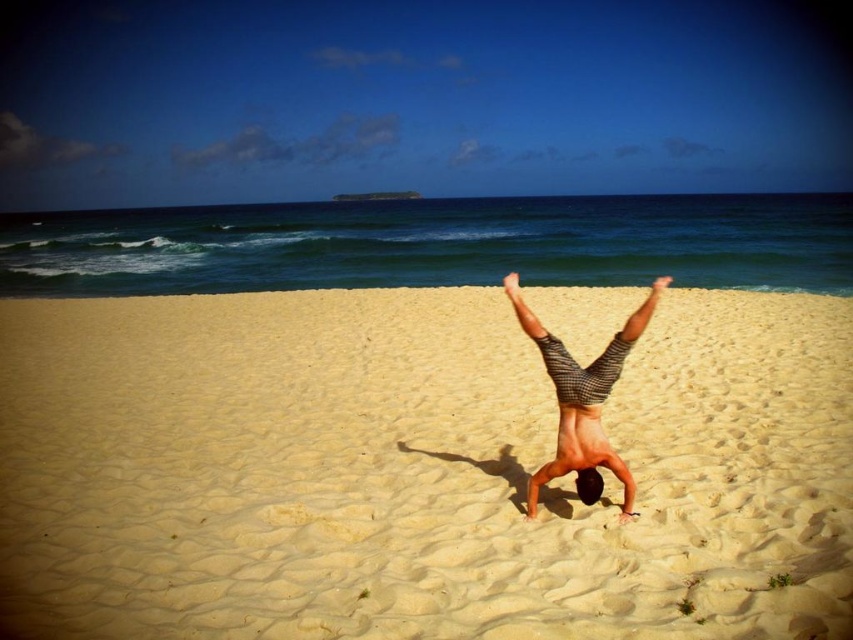
Is smooth yellow sand at center to the right of striped shorts at center from the viewer's perspective?

Incorrect, smooth yellow sand at center is not on the right side of striped shorts at center.

Is point (701, 458) more distant than point (598, 440)?

Yes, it is behind point (598, 440).

Find the location of `smooth yellow sand at center`. smooth yellow sand at center is located at coordinates (415, 470).